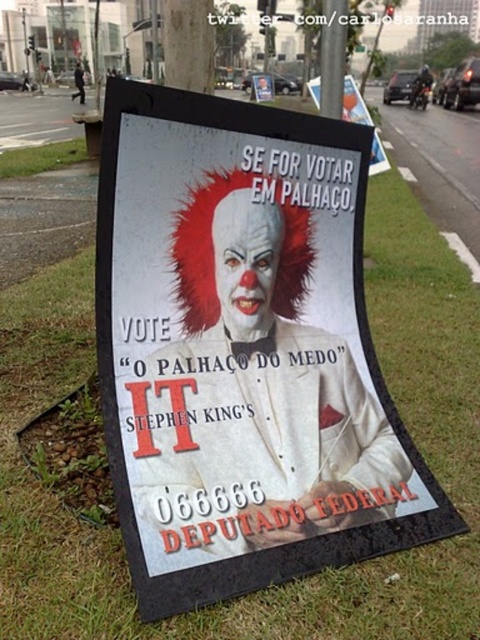
Looking at this image, you are a pedestrian walking on the street and see the metallic pole at upper center and the matte plastic poster at upper center. Which object is located higher up in the image?

A: The metallic pole at upper center is positioned over the matte plastic poster at upper center, so it is higher up in the image.

You are a pedestrian walking on the street and see the political campaign poster. The poster has the text in Portuguese. You want to know if the green grass at lower left is wider than the matte plastic poster at upper center. Can you confirm this?

The green grass at lower left has a larger width than the matte plastic poster at upper center, so yes, the green grass at lower left is wider than the matte plastic poster at upper center.

What is the relationship between the width of the white paper poster at center and the green grass at lower left in the political campaign poster scene?

The white paper poster at center is narrower than the green grass at lower left because its width is less than that of the grass area.